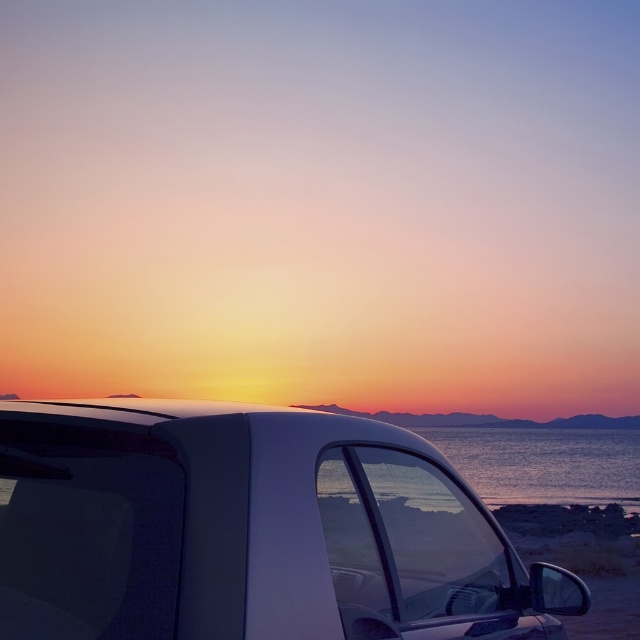
Where is `white glossy car at center`? The image size is (640, 640). white glossy car at center is located at coordinates (250, 529).

Which is behind, point (312, 448) or point (620, 486)?

The point (620, 486) is behind.

What do you see at coordinates (250, 529) in the screenshot?
I see `white glossy car at center` at bounding box center [250, 529].

At what (x,y) coordinates should I click in order to perform the action: click on white glossy car at center. Please return your answer as a coordinate pair (x, y). Image resolution: width=640 pixels, height=640 pixels. Looking at the image, I should click on (250, 529).